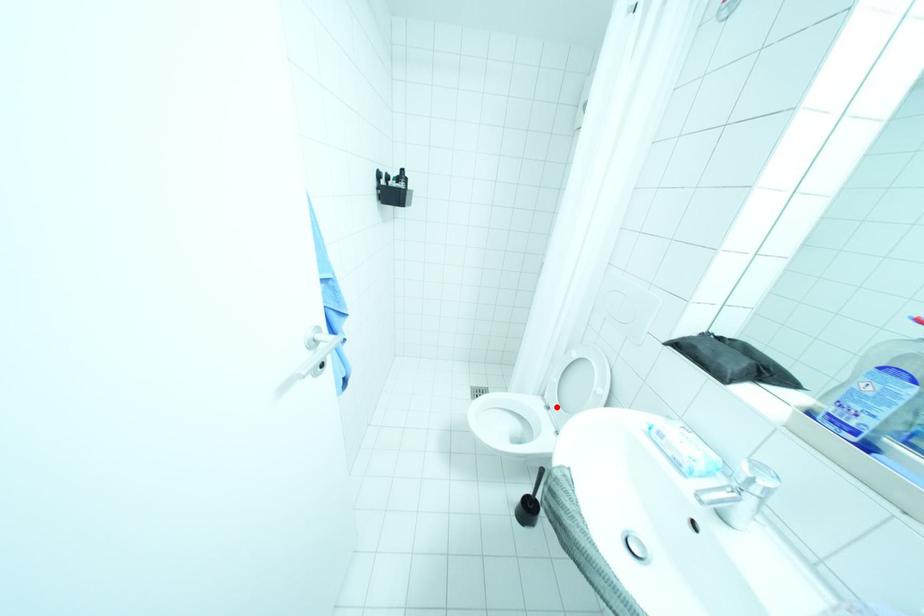
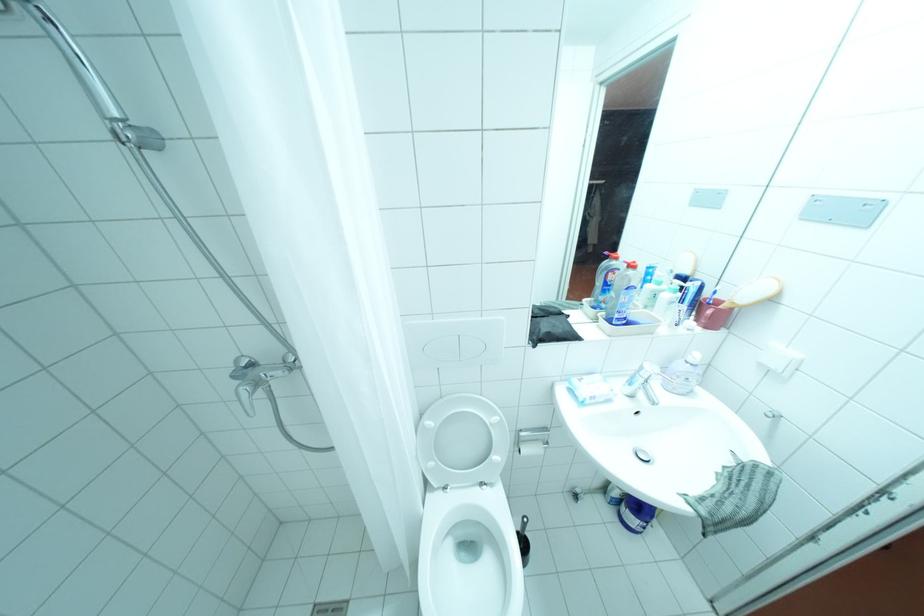
Where in the second image is the point corresponding to the highlighted location from the first image?

(455, 487)